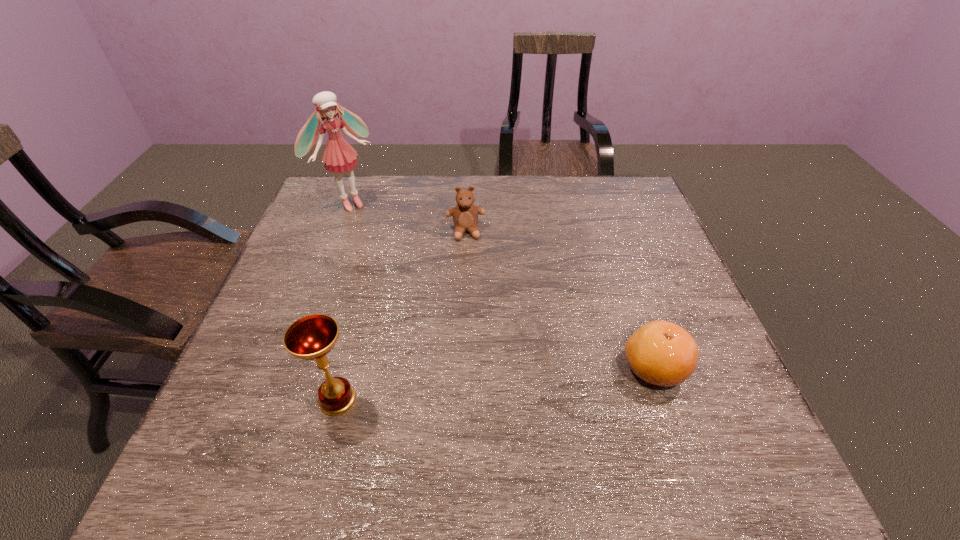
Identify the location of free area in between the farthest object and the shortest object. This screenshot has height=540, width=960. (501, 285).

You are a GUI agent. You are given a task and a screenshot of the screen. Output one action in this format:
    pyautogui.click(x=<x>, y=<y>)
    Task: Click on the free space between the third shortest object and the farthest object
    
    Given the screenshot: What is the action you would take?
    pyautogui.click(x=343, y=301)

At what (x,y) coordinates should I click in order to perform the action: click on free space between the shortest object and the chalice. Please return your answer as a coordinate pair (x, y). This screenshot has height=540, width=960. Looking at the image, I should click on (495, 384).

I want to click on vacant area that lies between the shortest object and the tallest object, so click(501, 285).

Where is `free spot between the rightmost object and the third nearest object`? This screenshot has height=540, width=960. free spot between the rightmost object and the third nearest object is located at coordinates (560, 300).

At what (x,y) coordinates should I click in order to perform the action: click on free space that is in between the chalice and the clementine. Please return your answer as a coordinate pair (x, y). Looking at the image, I should click on (495, 384).

At what (x,y) coordinates should I click in order to perform the action: click on blank region between the shortest object and the second tallest object. Please return your answer as a coordinate pair (x, y). Looking at the image, I should click on (495, 384).

Image resolution: width=960 pixels, height=540 pixels. What are the coordinates of `free area in between the clementine and the farthest object` in the screenshot? It's located at (501, 285).

Point out which object is positioned as the second nearest to the rightmost object. Please provide its 2D coordinates. Your answer should be formatted as a tuple, i.e. [(x, y)], where the tuple contains the x and y coordinates of a point satisfying the conditions above.

[(312, 337)]

Locate an element on the screen. The width and height of the screenshot is (960, 540). object that is the third closest to the chalice is located at coordinates (339, 156).